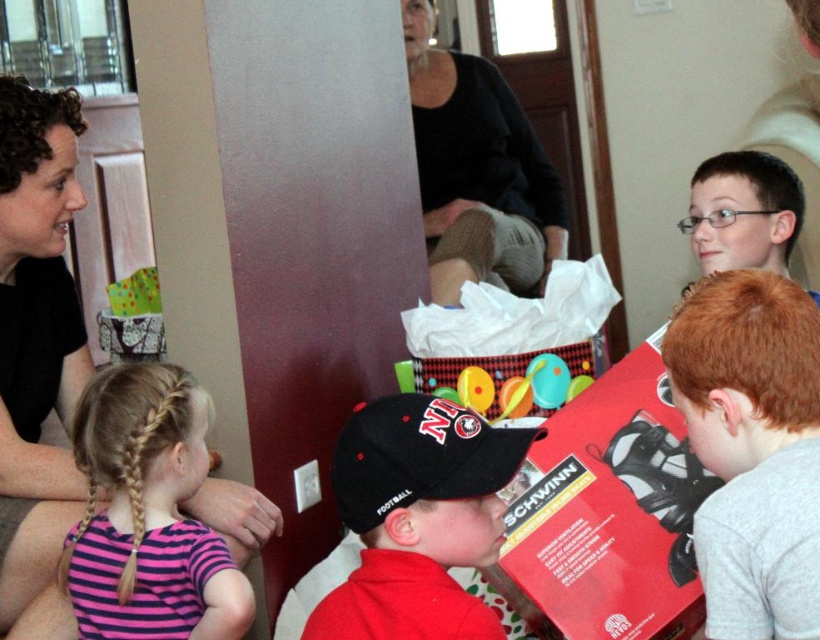
Question: Observing the image, what is the correct spatial positioning of pink striped shirt at lower left in reference to matte plastic toy at center?

Choices:
 (A) right
 (B) left

Answer: (B)

Question: Based on their relative distances, which object is nearer to the light gray cotton shirt at lower right?

Choices:
 (A) pink striped shirt at lower left
 (B) black matte baseball cap at center
 (C) matte black shirt at left
 (D) black cotton sweater at upper center

Answer: (B)

Question: Can you confirm if black cotton sweater at upper center is wider than matte plastic toy at center?

Choices:
 (A) no
 (B) yes

Answer: (B)

Question: Which object appears closest to the camera in this image?

Choices:
 (A) matte black shirt at left
 (B) pink striped shirt at lower left
 (C) matte plastic toy at center

Answer: (B)

Question: Among these objects, which one is nearest to the camera?

Choices:
 (A) black cotton sweater at upper center
 (B) matte plastic toy at center
 (C) matte black shirt at left

Answer: (C)

Question: Observing the image, what is the correct spatial positioning of matte black shirt at left in reference to matte plastic toy at center?

Choices:
 (A) below
 (B) above

Answer: (B)